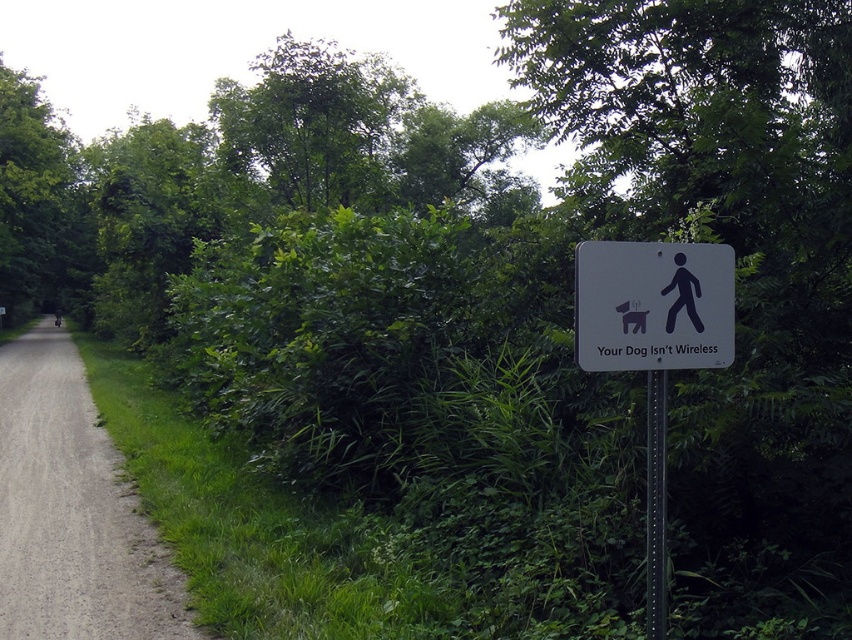
You are standing at the center of the dirt path in the image. There is a point marked at coordinates (x=655, y=506). Which object does this point correspond to?

The point at coordinates (x=655, y=506) corresponds to the black metal pole at right.

Looking at this image, you are standing on the dirt path and see the black metal pole at right and the black matte person at left. Which object is closer to you?

The black metal pole at right is closer to you because it is in front of the black matte person at left.